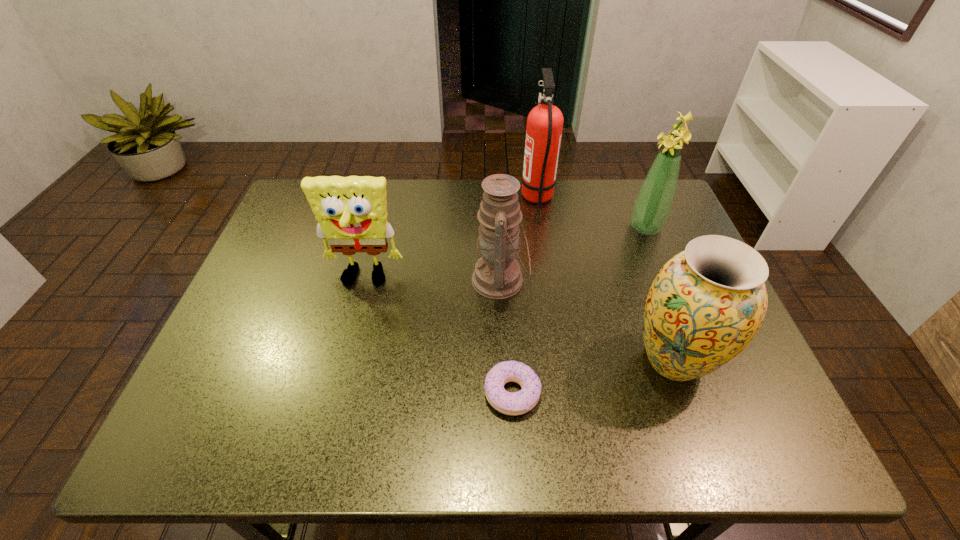
Locate an element on the screen. This screenshot has height=540, width=960. vacant region that satisfies the following two spatial constraints: 1. on the handle side of the fire extinguisher; 2. on the face of the sponge is located at coordinates [550, 279].

This screenshot has width=960, height=540. What are the coordinates of `free spot that satisfies the following two spatial constraints: 1. on the face of the oil lamp; 2. on the left side of the sponge` in the screenshot? It's located at (364, 280).

Identify the location of vacant space that satisfies the following two spatial constraints: 1. on the face of the shortest object; 2. on the left side of the leftmost object. (335, 393).

Locate an element on the screen. The height and width of the screenshot is (540, 960). blank area in the image that satisfies the following two spatial constraints: 1. on the face of the shortest object; 2. on the right side of the sponge is located at coordinates (335, 393).